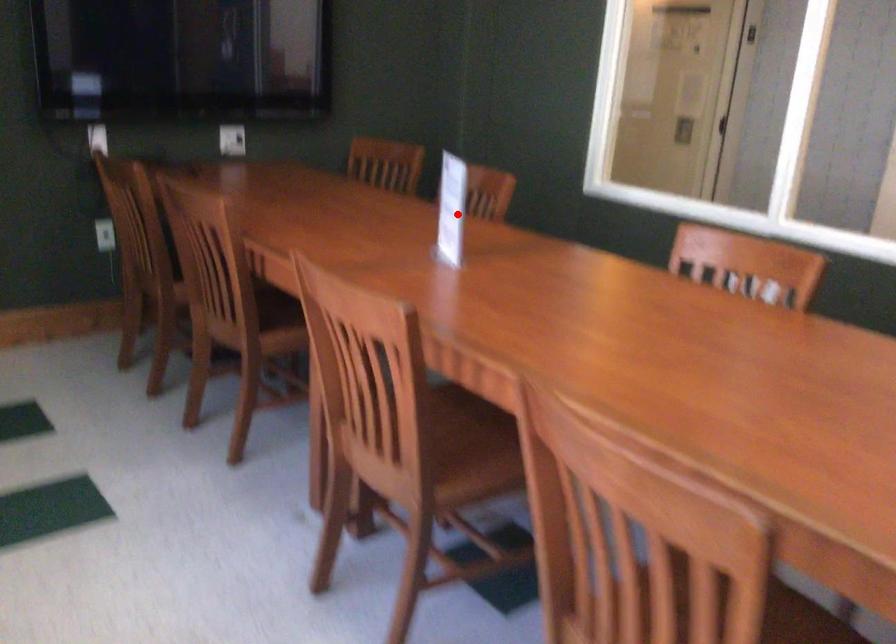
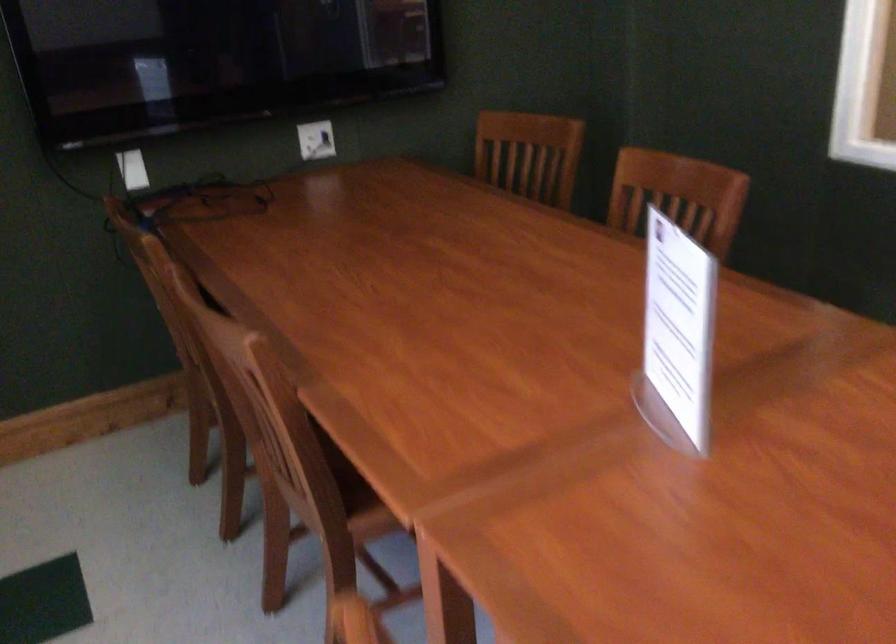
Where in the second image is the point corresponding to the highlighted location from the first image?

(677, 335)